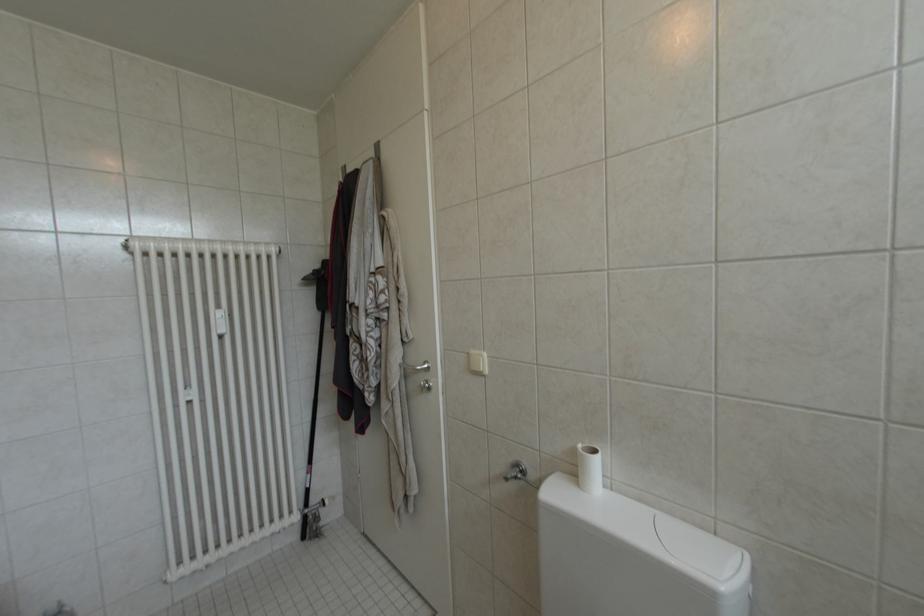
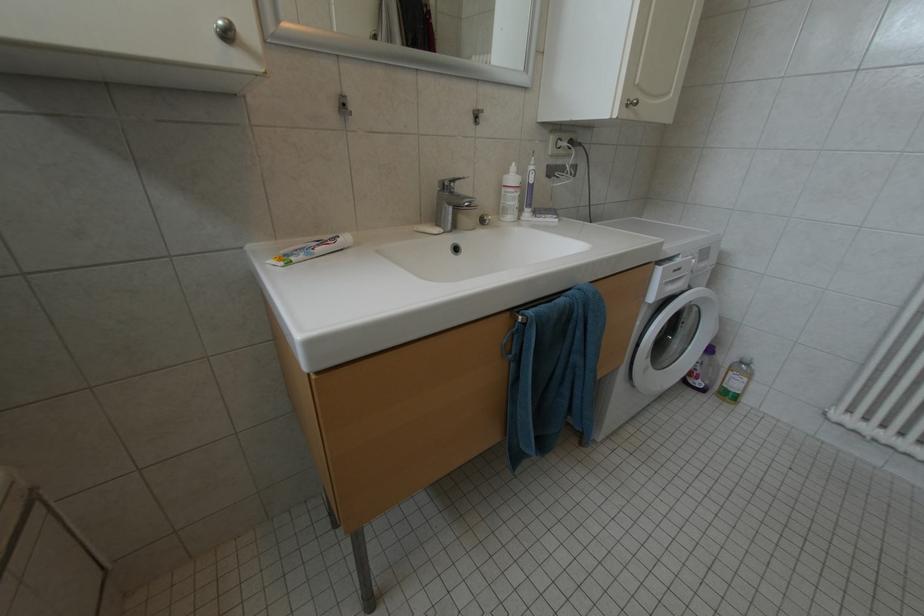
First-person continuous shooting, in which direction is the camera rotating?

The rotation direction of the camera is left-down.